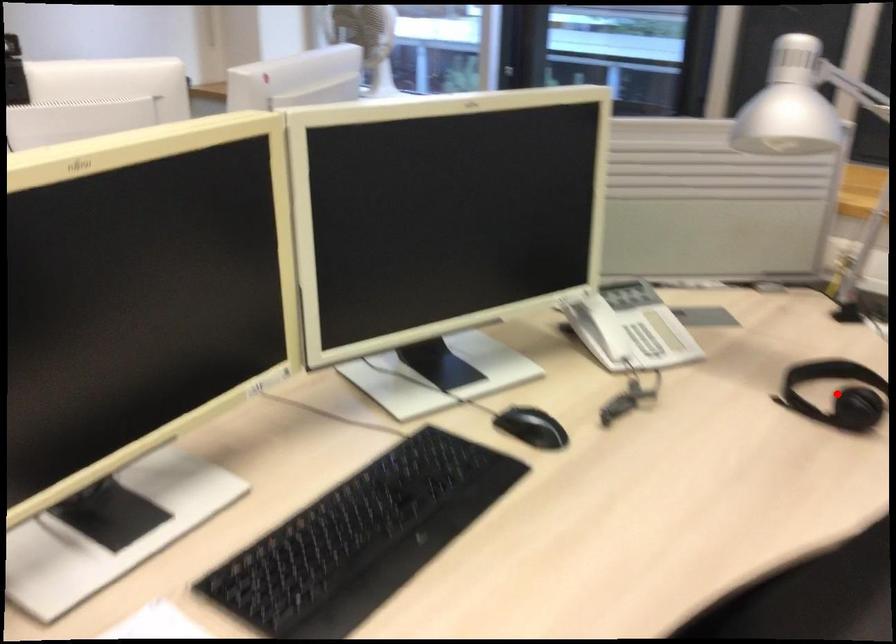
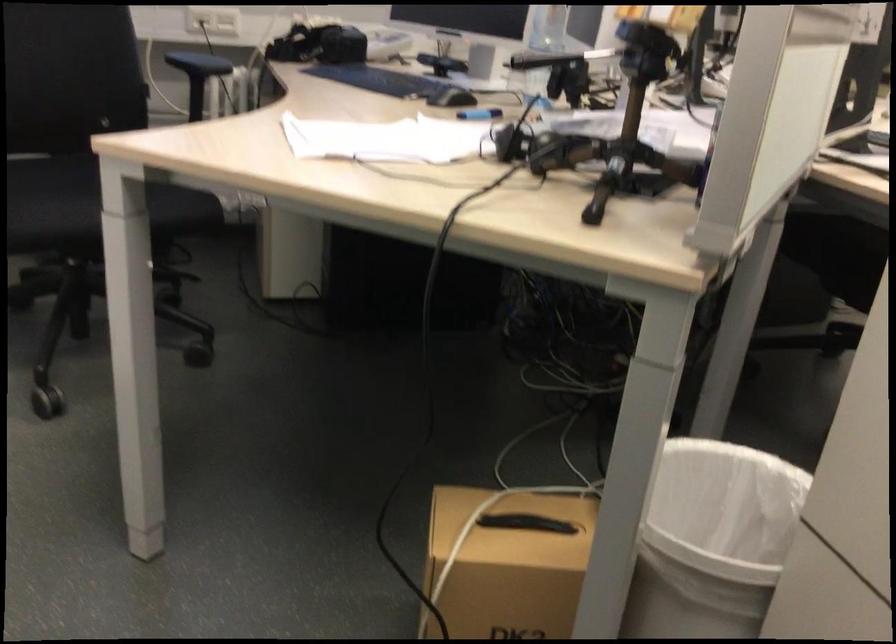
Question: I am providing you with two images of the same scene from different viewpoints. A red point is marked on the first image. At the location where the point appears in image 1, is it still visible in image 2?

Choices:
 (A) Yes
 (B) No

Answer: (B)